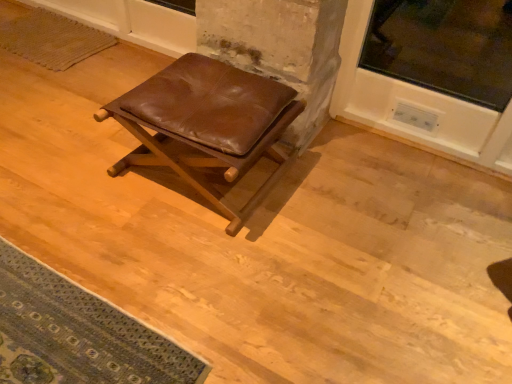
What do you see at coordinates (207, 123) in the screenshot? I see `brown leather stool at center` at bounding box center [207, 123].

Image resolution: width=512 pixels, height=384 pixels. In order to click on brown leather stool at center in this screenshot , I will do `click(207, 123)`.

I want to click on brown leather stool at center, so click(x=207, y=123).